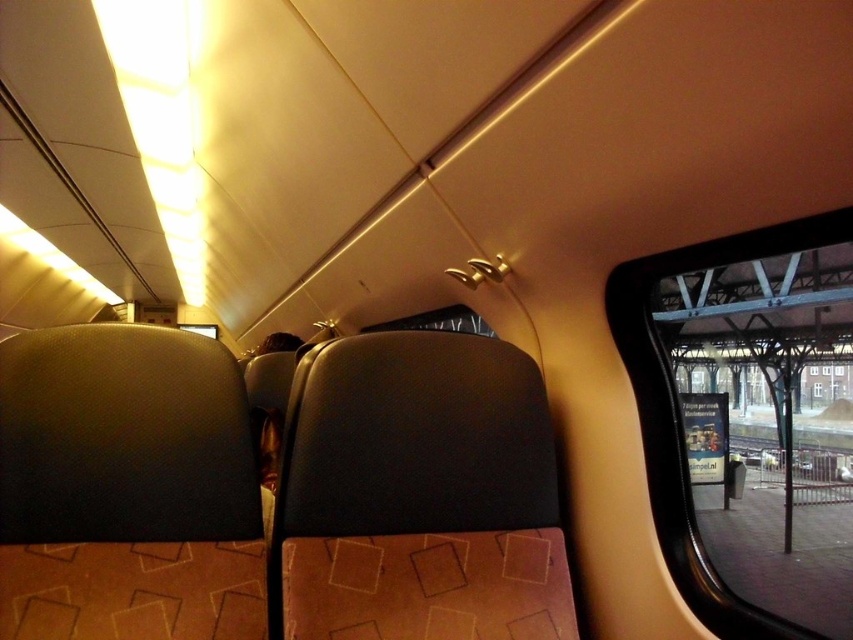
You are sitting in the train carriage and want to look outside. Where is the clear glass window at upper right located in terms of coordinates?

The clear glass window at upper right is located at point (677,412).

Looking at this image, you are sitting in the train carriage and want to look outside. Which window, the clear glass window at upper right or the transparent glass window at center, is higher up?

The clear glass window at upper right is located above the transparent glass window at center, so it is higher up.

You are sitting in the train carriage and want to look outside. Which window, the clear glass window at upper right or the transparent glass window at center, allows you to see more of the sky?

The clear glass window at upper right allows you to see more of the sky because it has a greater height compared to the transparent glass window at center.